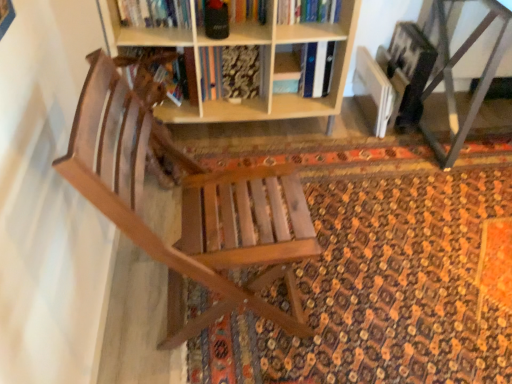
Question: Can you confirm if wooden chair at center is shorter than hardcover book at upper center?

Choices:
 (A) yes
 (B) no

Answer: (B)

Question: Are wooden chair at center and hardcover book at upper center making contact?

Choices:
 (A) yes
 (B) no

Answer: (B)

Question: Considering the relative positions of wooden chair at center and hardcover book at upper center in the image provided, is wooden chair at center to the right of hardcover book at upper center from the viewer's perspective?

Choices:
 (A) yes
 (B) no

Answer: (B)

Question: Are wooden chair at center and hardcover book at upper center far apart?

Choices:
 (A) no
 (B) yes

Answer: (B)

Question: From a real-world perspective, is wooden chair at center located beneath hardcover book at upper center?

Choices:
 (A) yes
 (B) no

Answer: (A)

Question: Is wooden chair at center facing away from hardcover book at upper center?

Choices:
 (A) no
 (B) yes

Answer: (A)

Question: From the image's perspective, does patterned carpet at center appear higher than hardcover book at upper center?

Choices:
 (A) no
 (B) yes

Answer: (A)

Question: Is patterned carpet at center oriented towards hardcover book at upper center?

Choices:
 (A) yes
 (B) no

Answer: (B)

Question: Is patterned carpet at center closer to camera compared to hardcover book at upper center?

Choices:
 (A) yes
 (B) no

Answer: (A)

Question: Can you confirm if patterned carpet at center is smaller than hardcover book at upper center?

Choices:
 (A) no
 (B) yes

Answer: (A)

Question: Is hardcover book at upper center surrounded by patterned carpet at center?

Choices:
 (A) yes
 (B) no

Answer: (B)

Question: Can you confirm if patterned carpet at center is shorter than hardcover book at upper center?

Choices:
 (A) no
 (B) yes

Answer: (B)

Question: Can you see hardcover book at upper center touching metallic gray table at lower right?

Choices:
 (A) no
 (B) yes

Answer: (A)